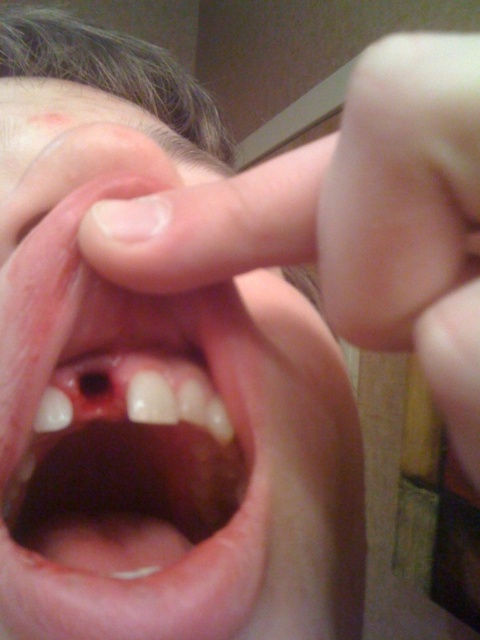
You are a dentist trying to reach a point in a patient mouth. The point is located at coordinates point (68,436). The dentist tool you are using has a maximum reach of 12 inches. Can you reach the point with this tool?

The point (68,436) is 12.59 inches from the viewer, which exceeds the dentist tool maximum reach of 12 inches. Therefore, the dentist cannot reach the point with this tool.